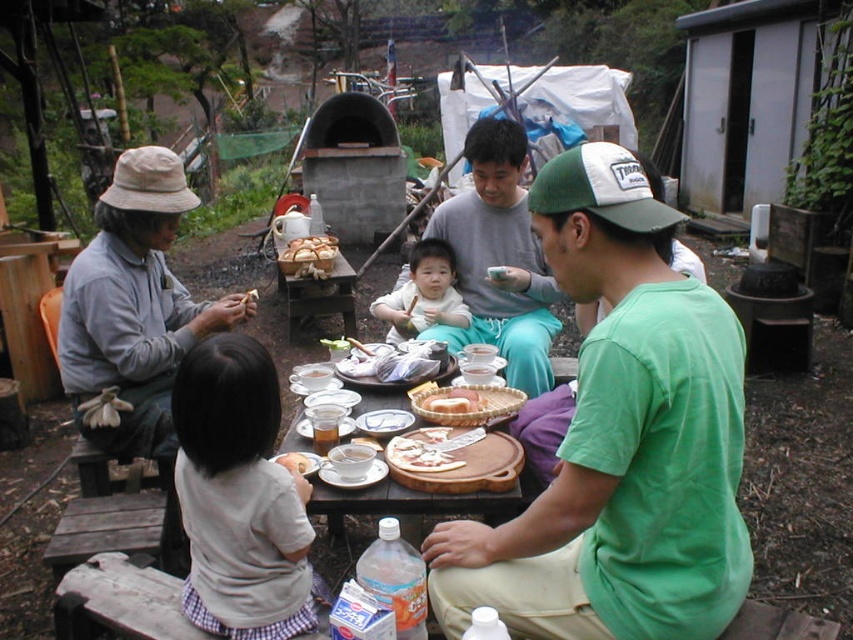
You are standing at the edge of the wooden platform and see both the light gray cotton shirt at lower left and the gray cotton shirt at left. Which one is positioned lower on the platform?

The light gray cotton shirt at lower left is positioned lower on the platform than the gray cotton shirt at left.

Consider the image. You are a photographer trying to capture a closeup of the smooth white bread at center without including the matte gray shirt at center in the frame. Is it possible to do so given their positions?

The matte gray shirt at center might be wider than smooth white bread at center, so there is a possibility that the shirt could block the view of the bread depending on their exact positioning. To ensure the bread is fully visible, adjust the angle or position to avoid the shirt overlapping.

You are organizing a picnic and need to decide where to place a small container of sauce. The matte gray shirt at center and the smooth white bread at center are both on the table. Which item has more space around it for placing the sauce?

The matte gray shirt at center has a larger size compared to the smooth white bread at center, so there is more space around the smooth white bread at center to place the sauce.